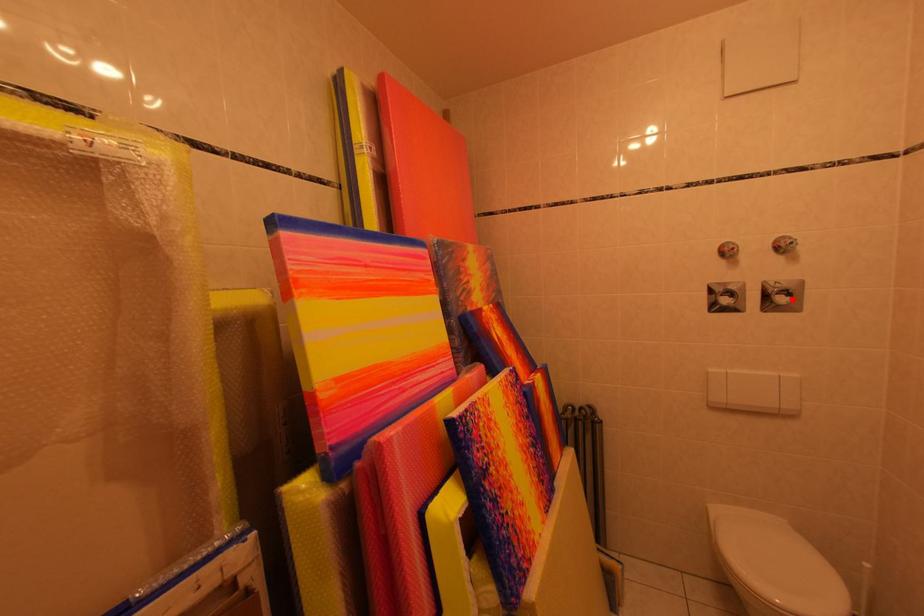
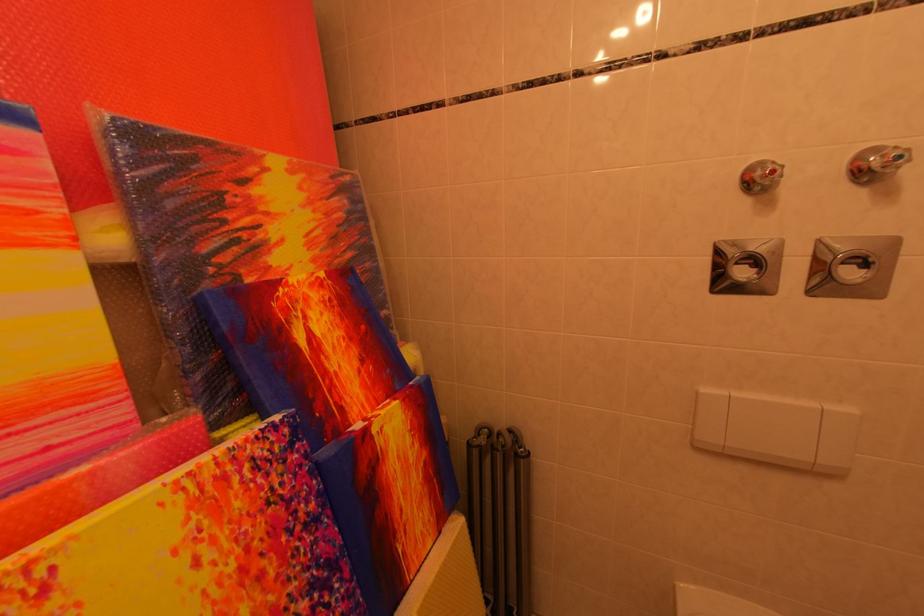
Question: I am providing you with two images of the same scene from different viewpoints. A red point is marked on the first image. Can you still see the location of the red point in image 2?

Choices:
 (A) Yes
 (B) No

Answer: (A)